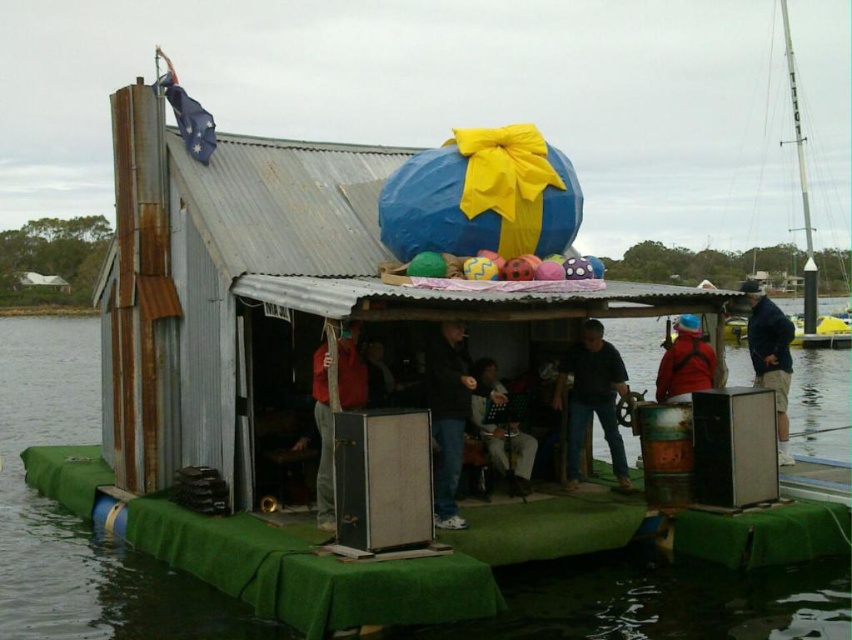
Question: Which is nearer to the red fabric jacket at center?

Choices:
 (A) dark blue shirt at center
 (B) green fabric at center
 (C) white paper music stand at center

Answer: (C)

Question: Which object appears farthest from the camera in this image?

Choices:
 (A) black matte jacket at center
 (B) dark blue jacket at center

Answer: (B)

Question: In this image, where is red fabric jacket at center located relative to red fleece jacket at center?

Choices:
 (A) right
 (B) left

Answer: (B)

Question: Is white paper music stand at center behind red fleece jacket at center?

Choices:
 (A) no
 (B) yes

Answer: (B)

Question: Which of the following is the farthest from the observer?

Choices:
 (A) (580, 390)
 (B) (444, 355)
 (C) (681, 317)

Answer: (A)

Question: Is dark blue shirt at center positioned in front of dark blue jacket at center?

Choices:
 (A) yes
 (B) no

Answer: (B)